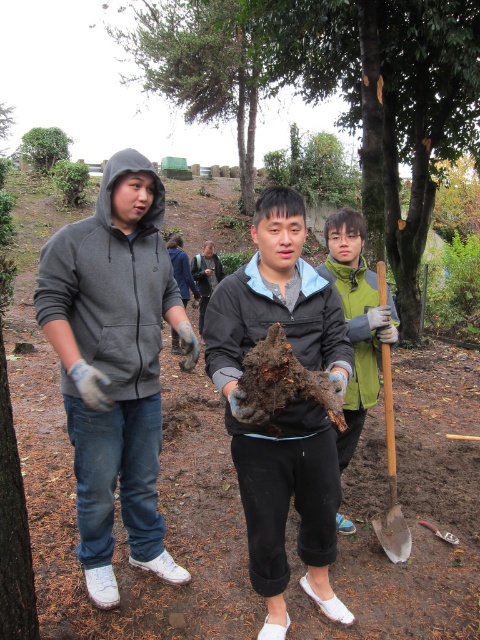
Question: Does green matte jacket at center appear on the left side of green matte sweatshirt at center?

Choices:
 (A) no
 (B) yes

Answer: (B)

Question: Which object is closer to the camera taking this photo?

Choices:
 (A) green matte sweatshirt at center
 (B) matte gray hoodie at left
 (C) green matte jacket at center

Answer: (B)

Question: Based on their relative distances, which object is nearer to the matte black sweatshirt at center?

Choices:
 (A) green matte sweatshirt at center
 (B) rough bark tree at center
 (C) wooden shovel at lower right

Answer: (A)

Question: Which of the following is the closest to the observer?

Choices:
 (A) (254, 451)
 (B) (403, 1)

Answer: (A)

Question: Is matte black sweatshirt at center smaller than green matte jacket at center?

Choices:
 (A) no
 (B) yes

Answer: (B)

Question: Does matte black sweatshirt at center appear on the right side of green matte jacket at center?

Choices:
 (A) no
 (B) yes

Answer: (A)